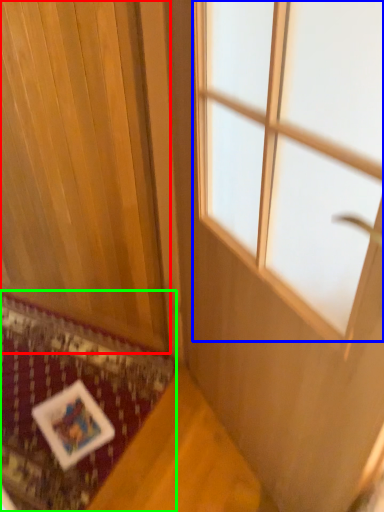
Question: Which object is positioned closest to curtain (highlighted by a red box)? Select from window (highlighted by a blue box) and mat (highlighted by a green box).

Choices:
 (A) window
 (B) mat

Answer: (B)